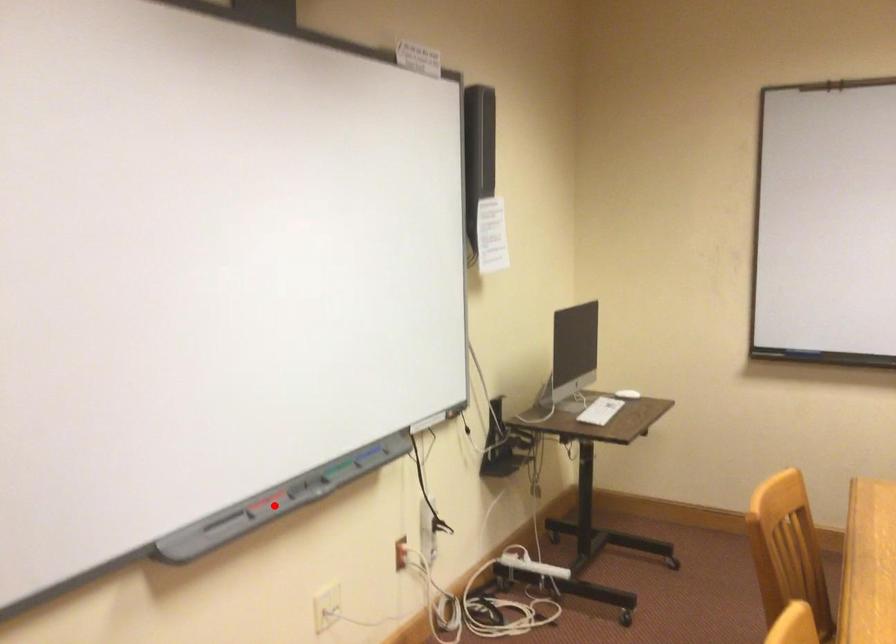
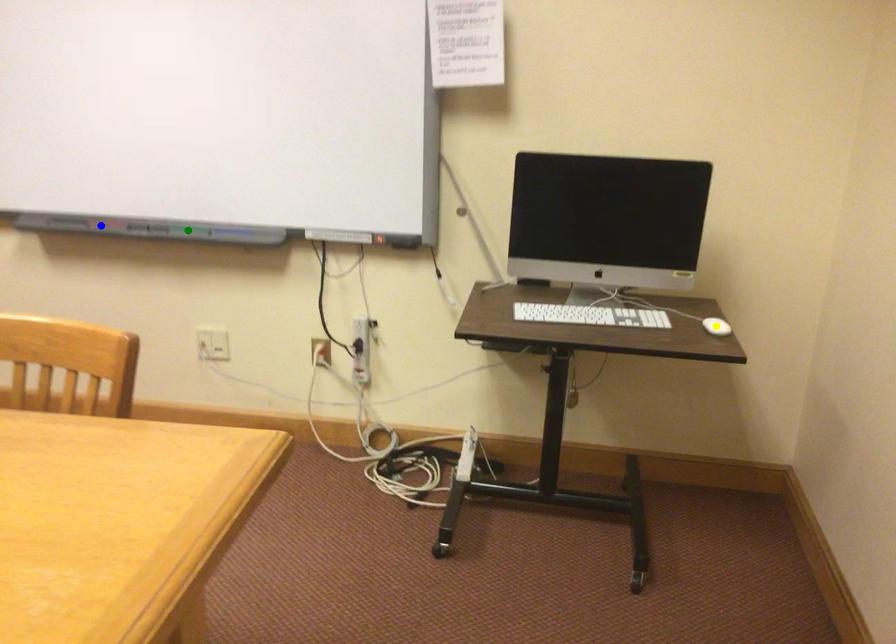
Question: I am providing you with two images of the same scene from different viewpoints. A red point is marked on the first image. You are given multiple points on the second image. Which point in image 2 represents the same 3d spot as the red point in image 1?

Choices:
 (A) blue point
 (B) yellow point
 (C) green point

Answer: (A)